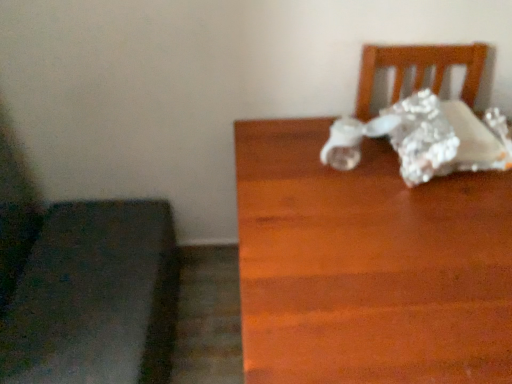
Question: Considering the relative positions of dark gray fabric cushion at lower left and wooden table at right in the image provided, is dark gray fabric cushion at lower left behind wooden table at right?

Choices:
 (A) no
 (B) yes

Answer: (B)

Question: Is dark gray fabric cushion at lower left shorter than wooden table at right?

Choices:
 (A) yes
 (B) no

Answer: (A)

Question: Can you see dark gray fabric cushion at lower left touching wooden table at right?

Choices:
 (A) no
 (B) yes

Answer: (A)

Question: Is dark gray fabric cushion at lower left facing away from wooden table at right?

Choices:
 (A) yes
 (B) no

Answer: (B)

Question: From a real-world perspective, does dark gray fabric cushion at lower left sit lower than wooden table at right?

Choices:
 (A) no
 (B) yes

Answer: (B)

Question: Is dark gray fabric cushion at lower left bigger than wooden table at right?

Choices:
 (A) no
 (B) yes

Answer: (A)

Question: Is wooden table at right directly adjacent to dark gray fabric cushion at lower left?

Choices:
 (A) yes
 (B) no

Answer: (B)

Question: Is wooden table at right surrounding dark gray fabric cushion at lower left?

Choices:
 (A) yes
 (B) no

Answer: (B)

Question: From a real-world perspective, is wooden table at right below dark gray fabric cushion at lower left?

Choices:
 (A) no
 (B) yes

Answer: (A)

Question: Is the position of wooden table at right more distant than that of dark gray fabric cushion at lower left?

Choices:
 (A) no
 (B) yes

Answer: (A)

Question: Can you confirm if wooden table at right is wider than dark gray fabric cushion at lower left?

Choices:
 (A) yes
 (B) no

Answer: (A)

Question: From the image's perspective, would you say wooden table at right is positioned over dark gray fabric cushion at lower left?

Choices:
 (A) no
 (B) yes

Answer: (B)

Question: From the image's perspective, is wooden table at right positioned above or below dark gray fabric cushion at lower left?

Choices:
 (A) below
 (B) above

Answer: (B)